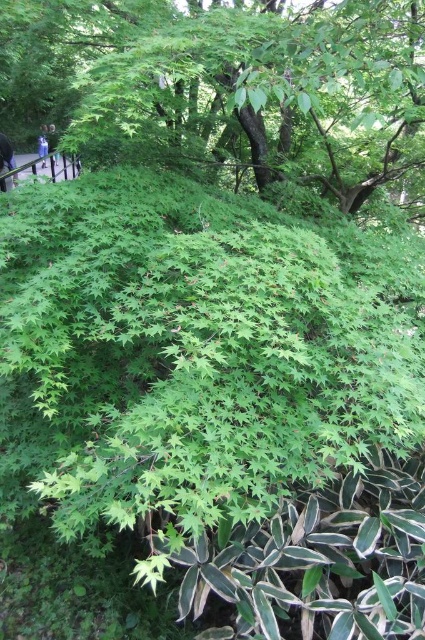
Which is below, green leafy bush at center or blue denim jeans at upper left?

green leafy bush at center is below.

Is green leafy bush at center further to the viewer compared to blue denim jeans at upper left?

No, green leafy bush at center is in front of blue denim jeans at upper left.

Locate an element on the screen. green leafy bush at center is located at coordinates (229, 90).

This screenshot has height=640, width=425. I want to click on green leafy bush at center, so click(229, 90).

Which is in front, point (241, 90) or point (6, 168)?

Point (241, 90) is in front.

Between green leafy bush at center and blue fabric at upper left, which one is positioned higher?

green leafy bush at center

Locate an element on the screen. The image size is (425, 640). green leafy bush at center is located at coordinates (229, 90).

Does wooden fence at upper left lie behind blue denim jeans at upper left?

No.

Is wooden fence at upper left to the left of blue denim jeans at upper left from the viewer's perspective?

In fact, wooden fence at upper left is to the right of blue denim jeans at upper left.

Locate an element on the screen. wooden fence at upper left is located at coordinates (51, 166).